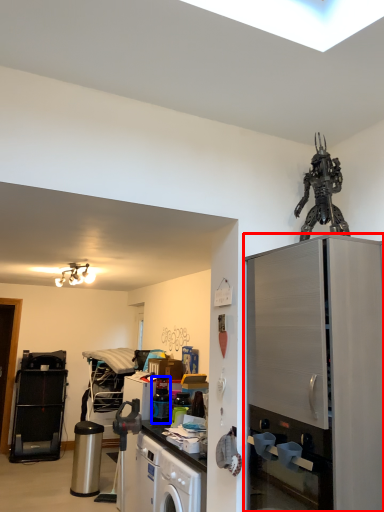
Question: Among these objects, which one is farthest to the camera, cabinetry (highlighted by a red box) or appliance (highlighted by a blue box)?

Choices:
 (A) cabinetry
 (B) appliance

Answer: (B)